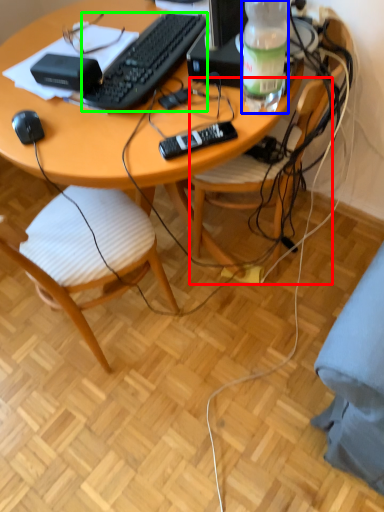
Question: Which object is positioned farthest from chair (highlighted by a red box)? Select from bottle (highlighted by a blue box) and computer keyboard (highlighted by a green box).

Choices:
 (A) bottle
 (B) computer keyboard

Answer: (B)